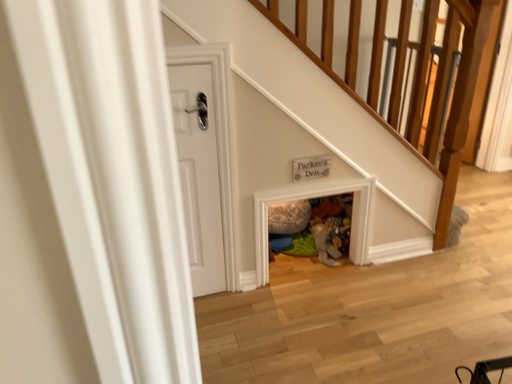
Image resolution: width=512 pixels, height=384 pixels. Identify the location of free space to the right of white glossy door at center. (241, 303).